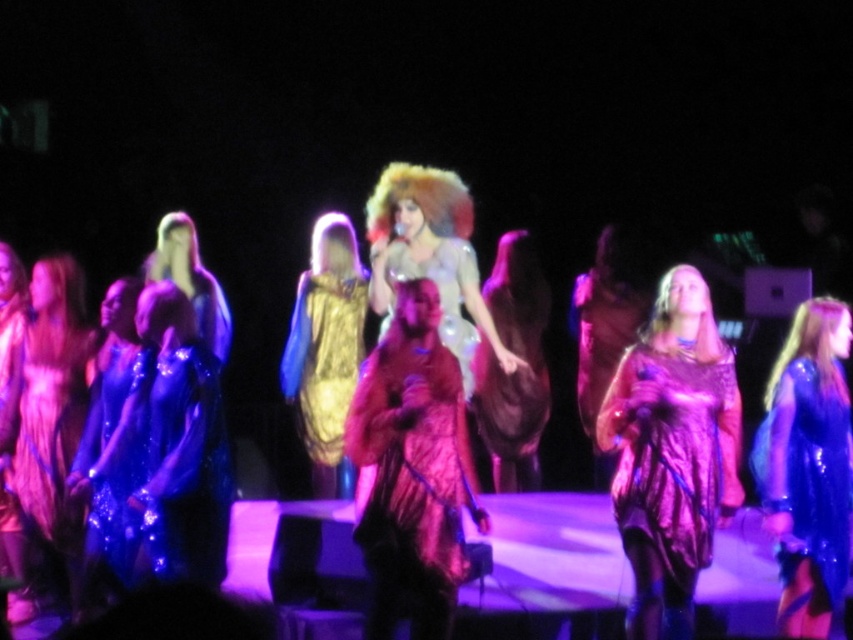
Who is taller, metallic purple dress at center or fuzzy pink fur coat at center?

metallic purple dress at center

Does metallic purple dress at center have a greater width compared to fuzzy pink fur coat at center?

Yes, metallic purple dress at center is wider than fuzzy pink fur coat at center.

Who is more forward, (619,467) or (357,531)?

Point (357,531)

This screenshot has width=853, height=640. Find the location of `metallic purple dress at center`. metallic purple dress at center is located at coordinates (672, 452).

Who is taller, fuzzy pink fur coat at center or gold sequined dress at center?

With more height is gold sequined dress at center.

Which is behind, point (428, 310) or point (320, 397)?

The point (320, 397) is more distant.

Between point (351, 444) and point (322, 253), which one is positioned behind?

The point (322, 253) is more distant.

Image resolution: width=853 pixels, height=640 pixels. I want to click on fuzzy pink fur coat at center, so click(410, 470).

The height and width of the screenshot is (640, 853). Describe the element at coordinates (517, 369) in the screenshot. I see `shiny brown dress at center` at that location.

The width and height of the screenshot is (853, 640). I want to click on shiny brown dress at center, so click(x=517, y=369).